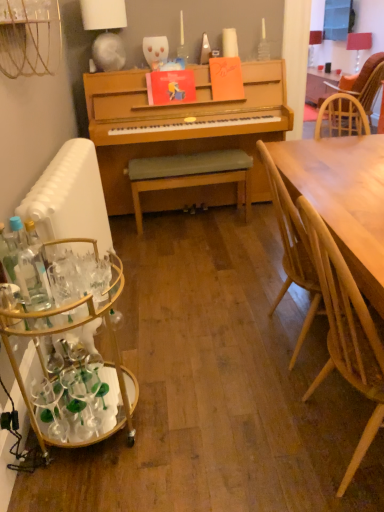
Question: Can you confirm if matte white lampshade at upper right, the first lamp in the top-to-bottom sequence, is positioned to the right of red fabric lampshade at upper right, the 2th lamp from the front?

Choices:
 (A) yes
 (B) no

Answer: (B)

Question: Does matte white lampshade at upper right, the 2th lamp viewed from the left, appear on the left side of red fabric lampshade at upper right, which is counted as the second lamp, starting from the back?

Choices:
 (A) no
 (B) yes

Answer: (B)

Question: Considering the relative sizes of matte white lampshade at upper right, the 2th lamp viewed from the left, and red fabric lampshade at upper right, acting as the second lamp starting from the top, in the image provided, is matte white lampshade at upper right, the 2th lamp viewed from the left, smaller than red fabric lampshade at upper right, acting as the second lamp starting from the top,?

Choices:
 (A) yes
 (B) no

Answer: (A)

Question: Is the surface of matte white lampshade at upper right, which is the third lamp from front to back, in direct contact with red fabric lampshade at upper right, which is counted as the second lamp, starting from the back?

Choices:
 (A) no
 (B) yes

Answer: (A)

Question: Does matte white lampshade at upper right, marked as the third lamp in a bottom-to-top arrangement, lie behind red fabric lampshade at upper right, the 2th lamp from the front?

Choices:
 (A) yes
 (B) no

Answer: (A)

Question: In the image, is matte white lampshade at upper right, the first lamp in the top-to-bottom sequence, positioned in front of or behind clear glass bottle at left, acting as the first bottle starting from the right?

Choices:
 (A) front
 (B) behind

Answer: (B)

Question: Is matte white lampshade at upper right, the 2th lamp in the right-to-left sequence, inside the boundaries of clear glass bottle at left, which appears as the second bottle when viewed from the left, or outside?

Choices:
 (A) inside
 (B) outside

Answer: (B)

Question: From a real-world perspective, is matte white lampshade at upper right, which is the third lamp from front to back, physically located above or below clear glass bottle at left, acting as the first bottle starting from the right?

Choices:
 (A) above
 (B) below

Answer: (A)

Question: Based on their sizes in the image, would you say matte white lampshade at upper right, which ranks as the 1th lamp in back-to-front order, is bigger or smaller than clear glass bottle at left, which appears as the second bottle when viewed from the left?

Choices:
 (A) big
 (B) small

Answer: (A)

Question: Considering the positions of red fabric lampshade at upper right, which is counted as the first lamp, starting from the right, and clear glass bottle at left, acting as the first bottle starting from the right, in the image, is red fabric lampshade at upper right, which is counted as the first lamp, starting from the right, bigger or smaller than clear glass bottle at left, acting as the first bottle starting from the right,?

Choices:
 (A) small
 (B) big

Answer: (B)

Question: In the image, is red fabric lampshade at upper right, which appears as the second lamp when ordered from the bottom, positioned in front of or behind clear glass bottle at left, which appears as the second bottle when viewed from the left?

Choices:
 (A) front
 (B) behind

Answer: (B)

Question: From the image's perspective, is red fabric lampshade at upper right, which appears as the second lamp when ordered from the bottom, positioned above or below clear glass bottle at left, acting as the first bottle starting from the right?

Choices:
 (A) above
 (B) below

Answer: (A)

Question: Is point (370, 33) closer or farther from the camera than point (21, 240)?

Choices:
 (A) farther
 (B) closer

Answer: (A)

Question: From the image's perspective, is clear glass bottle at left, which appears as the second bottle when viewed from the left, positioned above or below gray fabric bench at center?

Choices:
 (A) above
 (B) below

Answer: (B)

Question: Is clear glass bottle at left, which appears as the second bottle when viewed from the left, wider or thinner than gray fabric bench at center?

Choices:
 (A) thin
 (B) wide

Answer: (A)